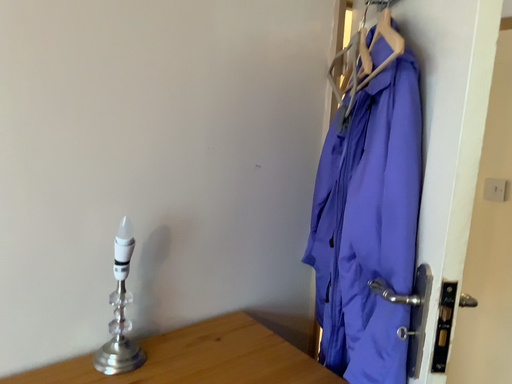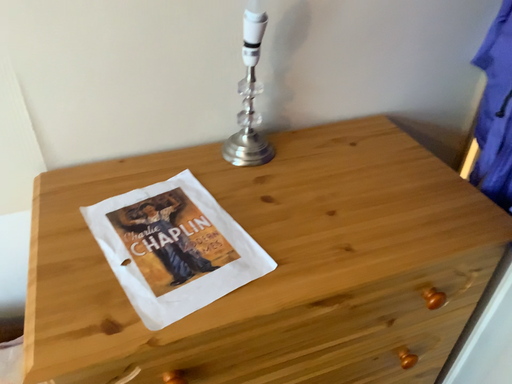
Question: How did the camera likely rotate when shooting the video?

Choices:
 (A) rotated right
 (B) rotated left

Answer: (B)